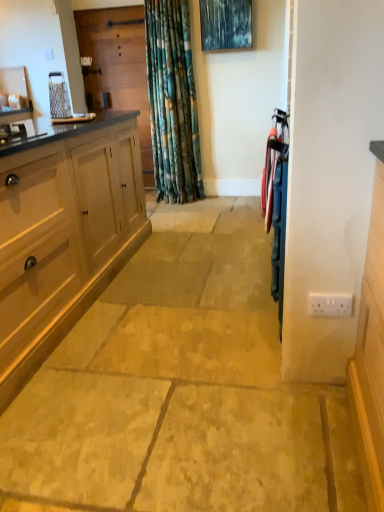
Question: Can you confirm if metallic blue screen door at right, placed as the first screen door when sorted from right to left, is taller than metallic blue painting at upper center?

Choices:
 (A) no
 (B) yes

Answer: (B)

Question: Can you confirm if metallic blue screen door at right, acting as the 2th screen door starting from the top, is smaller than metallic blue painting at upper center?

Choices:
 (A) yes
 (B) no

Answer: (B)

Question: Considering the relative positions of metallic blue screen door at right, the 2th screen door from the left, and metallic blue painting at upper center in the image provided, is metallic blue screen door at right, the 2th screen door from the left, to the right of metallic blue painting at upper center from the viewer's perspective?

Choices:
 (A) yes
 (B) no

Answer: (A)

Question: Considering the relative sizes of metallic blue screen door at right, acting as the 2th screen door starting from the top, and metallic blue painting at upper center in the image provided, is metallic blue screen door at right, acting as the 2th screen door starting from the top, shorter than metallic blue painting at upper center?

Choices:
 (A) no
 (B) yes

Answer: (A)

Question: Is metallic blue screen door at right, marked as the second screen door in a back-to-front arrangement, positioned far away from metallic blue painting at upper center?

Choices:
 (A) no
 (B) yes

Answer: (B)

Question: Is the surface of metallic blue screen door at right, the 1th screen door from the front, in direct contact with metallic blue painting at upper center?

Choices:
 (A) no
 (B) yes

Answer: (A)

Question: Can you confirm if wooden screen door at upper left, marked as the second screen door in a bottom-to-top arrangement, is positioned to the left of metallic blue painting at upper center?

Choices:
 (A) no
 (B) yes

Answer: (B)

Question: From the image's perspective, is wooden screen door at upper left, which is the second screen door in front-to-back order, on metallic blue painting at upper center?

Choices:
 (A) yes
 (B) no

Answer: (B)

Question: Can you confirm if wooden screen door at upper left, the second screen door from the right, is positioned to the right of metallic blue painting at upper center?

Choices:
 (A) yes
 (B) no

Answer: (B)

Question: Is wooden screen door at upper left, marked as the second screen door in a bottom-to-top arrangement, taller than metallic blue painting at upper center?

Choices:
 (A) no
 (B) yes

Answer: (B)

Question: Could you tell me if wooden screen door at upper left, which is the second screen door in front-to-back order, is facing metallic blue painting at upper center?

Choices:
 (A) yes
 (B) no

Answer: (B)

Question: Is the depth of wooden screen door at upper left, which is the 1th screen door in back-to-front order, greater than that of metallic blue painting at upper center?

Choices:
 (A) yes
 (B) no

Answer: (A)

Question: Considering the relative positions of white plastic electric outlet at lower right and wooden screen door at upper left, arranged as the 1th screen door when viewed from the top, in the image provided, is white plastic electric outlet at lower right to the left of wooden screen door at upper left, arranged as the 1th screen door when viewed from the top, from the viewer's perspective?

Choices:
 (A) no
 (B) yes

Answer: (A)